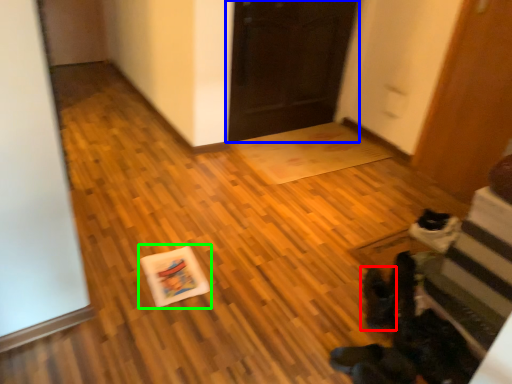
Question: Which is nearer to the footwear (highlighted by a red box)? door (highlighted by a blue box) or postcard (highlighted by a green box).

Choices:
 (A) door
 (B) postcard

Answer: (B)